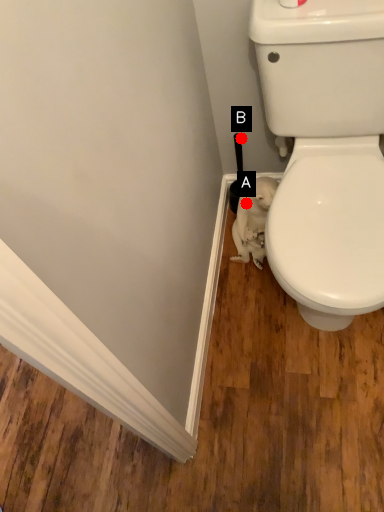
Question: Two points are circled on the image, labeled by A and B beside each circle. Which of the following is the closest to the observer?

Choices:
 (A) A is closer
 (B) B is closer

Answer: (A)